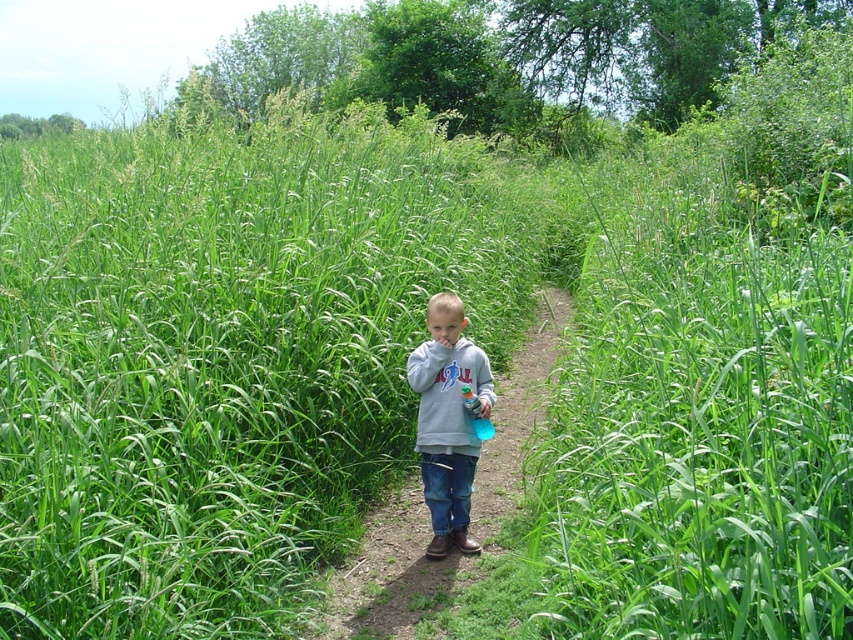
Is point (384, 612) less distant than point (444, 492)?

Yes.

Who is shorter, gray sweatshirt at center or gray fleece sweatshirt at center?

Standing shorter between the two is gray sweatshirt at center.

Who is more distant from viewer, (486, 538) or (436, 356)?

The point (486, 538) is more distant.

The height and width of the screenshot is (640, 853). Find the location of `gray sweatshirt at center`. gray sweatshirt at center is located at coordinates (392, 573).